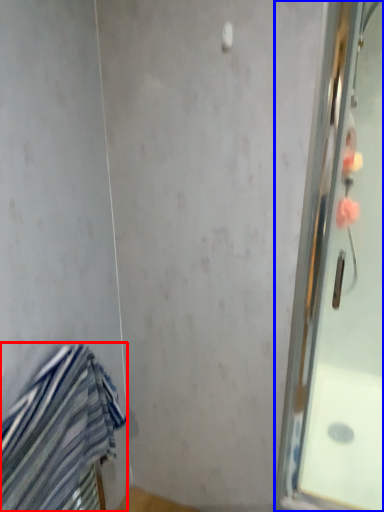
Question: Which point is closer to the camera, towel (highlighted by a red box) or screen door (highlighted by a blue box)?

Choices:
 (A) towel
 (B) screen door

Answer: (A)